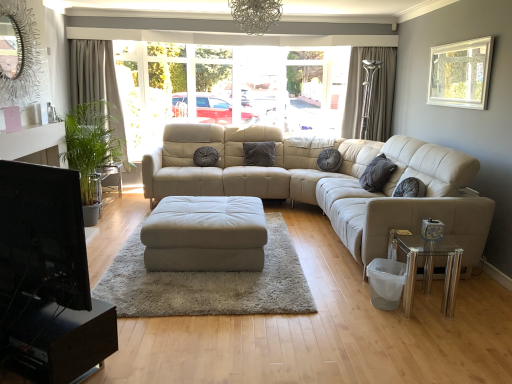
At what (x,y) coordinates should I click in order to perform the action: click on beige fabric curtain at left, placed as the second curtain when sorted from right to left. Please return your answer as a coordinate pair (x, y). Looking at the image, I should click on (98, 89).

Describe the element at coordinates (426, 266) in the screenshot. This screenshot has width=512, height=384. I see `transparent glass table at lower right` at that location.

Find the location of `white glossy side table at left`. white glossy side table at left is located at coordinates (105, 178).

From the image's perspective, is clear glass window at center over black glossy tv at lower left?

Yes.

The height and width of the screenshot is (384, 512). I want to click on entertainment center lying in front of the clear glass window at center, so [x=48, y=278].

Consider the image. Between clear glass window at center and black glossy tv at lower left, which one appears on the left side from the viewer's perspective?

From the viewer's perspective, black glossy tv at lower left appears more on the left side.

Which point is more distant from viewer, (268, 100) or (21, 345)?

Positioned behind is point (268, 100).

Considering the relative sizes of white framed window at upper right and gray matte pillow at center, which is the 3th pillow from left to right, in the image provided, is white framed window at upper right shorter than gray matte pillow at center, which is the 3th pillow from left to right,?

No.

Is white framed window at upper right looking in the opposite direction of gray matte pillow at center, which is the third pillow in back-to-front order?

No, white framed window at upper right is not facing away from gray matte pillow at center, which is the third pillow in back-to-front order.

From the image's perspective, is white framed window at upper right above or below gray matte pillow at center, placed as the first pillow when sorted from front to back?

Based on their image positions, white framed window at upper right is located above gray matte pillow at center, placed as the first pillow when sorted from front to back.

Is velvet gray pillow at center, the 2th pillow positioned from the left, placed right next to beige fabric curtain at left, which is counted as the 1th curtain, starting from the left?

No, velvet gray pillow at center, the 2th pillow positioned from the left, is not beside beige fabric curtain at left, which is counted as the 1th curtain, starting from the left.

Considering the positions of objects velvet gray pillow at center, the third pillow when ordered from front to back, and beige fabric curtain at left, which is counted as the 1th curtain, starting from the left, in the image provided, who is in front, velvet gray pillow at center, the third pillow when ordered from front to back, or beige fabric curtain at left, which is counted as the 1th curtain, starting from the left,?

beige fabric curtain at left, which is counted as the 1th curtain, starting from the left.

Is point (251, 149) positioned in front of point (80, 66)?

No, it is not.

Is white leather ottoman at center wider than beige fabric curtain at left, which is counted as the 1th curtain, starting from the left?

Indeed, white leather ottoman at center has a greater width compared to beige fabric curtain at left, which is counted as the 1th curtain, starting from the left.

Is white leather ottoman at center shorter than beige fabric curtain at left, which is counted as the 1th curtain, starting from the left?

Yes.

How distant is white leather ottoman at center from beige fabric curtain at left, placed as the second curtain when sorted from right to left?

10.94 feet.

Find the location of `the 1st curtain behind the metallic wire chandelier at upper center`. the 1st curtain behind the metallic wire chandelier at upper center is located at coordinates (98, 89).

Does point (257, 32) lie behind point (102, 79)?

That is False.

From a real-world perspective, is metallic wire chandelier at upper center above or below beige fabric curtain at left, placed as the second curtain when sorted from right to left?

In terms of real-world spatial position, metallic wire chandelier at upper center is above beige fabric curtain at left, placed as the second curtain when sorted from right to left.

Is metallic wire chandelier at upper center thinner than white framed window at upper right?

No.

From the image's perspective, which object appears higher, metallic wire chandelier at upper center or white framed window at upper right?

metallic wire chandelier at upper center is shown above in the image.

Which is more to the right, metallic wire chandelier at upper center or white framed window at upper right?

white framed window at upper right.

From the image's perspective, is white leather ottoman at center under silky gray curtain at right, which appears as the 1th curtain when viewed from the right?

Yes.

Is the depth of white leather ottoman at center greater than that of silky gray curtain at right, which appears as the 1th curtain when viewed from the right?

No, white leather ottoman at center is in front of silky gray curtain at right, which appears as the 1th curtain when viewed from the right.

From a real-world perspective, relative to silky gray curtain at right, which appears as the 1th curtain when viewed from the right, is white leather ottoman at center vertically above or below?

white leather ottoman at center is below silky gray curtain at right, which appears as the 1th curtain when viewed from the right.

Image resolution: width=512 pixels, height=384 pixels. Find the location of `window frame above the black glossy tv at lower left (from the image's perspective)`. window frame above the black glossy tv at lower left (from the image's perspective) is located at coordinates click(293, 87).

In order to click on window above the gray matte pillow at center, placed as the first pillow when sorted from front to back (from a real-world perspective) in this screenshot , I will do `click(460, 74)`.

Estimate the real-world distances between objects in this image. Which object is closer to white glossy side table at left, gray matte pillow at center, which is the third pillow in back-to-front order, or metallic wire chandelier at upper center?

Among the two, metallic wire chandelier at upper center is located nearer to white glossy side table at left.

Considering their positions, is white framed window at upper right positioned closer to suede-like dark gray pillow at center, which is the first pillow in left-to-right order, than gray matte pillow at center, the 1th pillow positioned from the right?

gray matte pillow at center, the 1th pillow positioned from the right.

Based on their spatial positions, is metallic wire chandelier at upper center or white glossy side table at left closer to white leather ottoman at center?

The object closer to white leather ottoman at center is metallic wire chandelier at upper center.

From the image, which object appears to be farther from velvet gray pillow at center, the 2th pillow viewed from the right, white leather ottoman at center or black glossy tv at lower left?

black glossy tv at lower left is further to velvet gray pillow at center, the 2th pillow viewed from the right.

From the image, which object appears to be farther from beige fabric curtain at left, which is counted as the 1th curtain, starting from the left, gray matte pillow at center, placed as the first pillow when sorted from front to back, or black glossy tv at lower left?

Based on the image, black glossy tv at lower left appears to be further to beige fabric curtain at left, which is counted as the 1th curtain, starting from the left.

Looking at the image, which one is located further to black glossy tv at lower left, white leather ottoman at center or velvet gray pillow at center, the 2th pillow positioned from the left?

Based on the image, velvet gray pillow at center, the 2th pillow positioned from the left, appears to be further to black glossy tv at lower left.

Which object lies nearer to the anchor point gray matte pillow at center, which is the 3th pillow from left to right, suede-like dark gray pillow at center, the 2th pillow viewed from the front, or white glossy side table at left?

Based on the image, suede-like dark gray pillow at center, the 2th pillow viewed from the front, appears to be nearer to gray matte pillow at center, which is the 3th pillow from left to right.

Based on the photo, based on their spatial positions, is gray matte pillow at center, placed as the first pillow when sorted from front to back, or suede-like dark gray pillow at center, which is the first pillow in left-to-right order, closer to white framed window at upper right?

The object closer to white framed window at upper right is gray matte pillow at center, placed as the first pillow when sorted from front to back.

Image resolution: width=512 pixels, height=384 pixels. I want to click on pillow between black glossy tv at lower left and beige fabric curtain at left, placed as the second curtain when sorted from right to left, from front to back, so click(x=377, y=173).

Locate an element on the screen. This screenshot has width=512, height=384. footrest between transparent glass table at lower right and velvet gray pillow at center, the 2th pillow viewed from the right, from front to back is located at coordinates click(x=205, y=234).

The image size is (512, 384). In order to click on footrest between black glossy tv at lower left and gray matte pillow at center, which is the 3th pillow from left to right, in the horizontal direction in this screenshot , I will do `click(205, 234)`.

The width and height of the screenshot is (512, 384). What are the coordinates of `footrest between suede-like dark gray pillow at center, the third pillow from the right, and white framed window at upper right` in the screenshot? It's located at (205, 234).